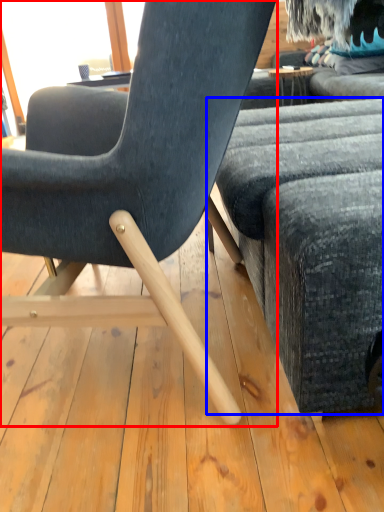
Question: Which of the following is the farthest to the observer, chair (highlighted by a red box) or studio couch (highlighted by a blue box)?

Choices:
 (A) chair
 (B) studio couch

Answer: (B)